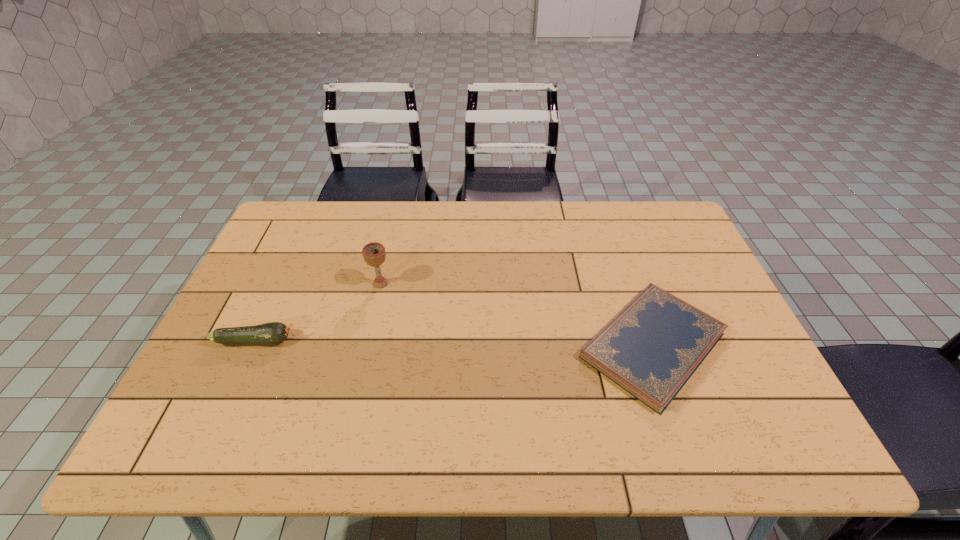
What are the coordinates of `vacant space that satisfies the following two spatial constraints: 1. on the back side of the shortest object; 2. at the blossom end of the second shortest object` in the screenshot? It's located at (x=651, y=340).

Locate an element on the screen. Image resolution: width=960 pixels, height=540 pixels. vacant space that satisfies the following two spatial constraints: 1. at the blossom end of the zucchini; 2. on the right side of the shortest object is located at coordinates (253, 346).

Image resolution: width=960 pixels, height=540 pixels. Identify the location of vacant region that satisfies the following two spatial constraints: 1. at the blossom end of the paperback book; 2. on the left side of the zucchini. (253, 346).

Image resolution: width=960 pixels, height=540 pixels. I want to click on vacant space that satisfies the following two spatial constraints: 1. on the back side of the shortest object; 2. at the blossom end of the second shortest object, so click(x=651, y=340).

Where is `free space that satisfies the following two spatial constraints: 1. at the blossom end of the leftmost object; 2. on the left side of the shortest object`? free space that satisfies the following two spatial constraints: 1. at the blossom end of the leftmost object; 2. on the left side of the shortest object is located at coordinates (253, 346).